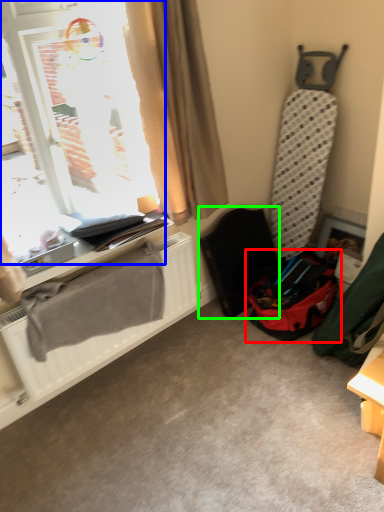
Question: Which object is the farthest from luggage and bags (highlighted by a red box)? Choose among these: window (highlighted by a blue box) or folding chair (highlighted by a green box).

Choices:
 (A) window
 (B) folding chair

Answer: (A)